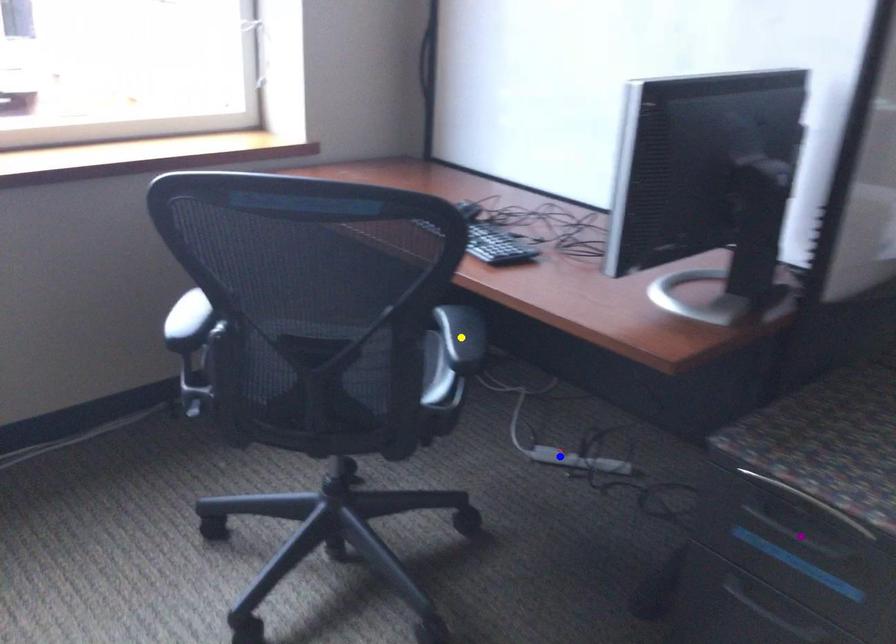
Order these from nearest to farthest:
purple point
yellow point
blue point

purple point
yellow point
blue point